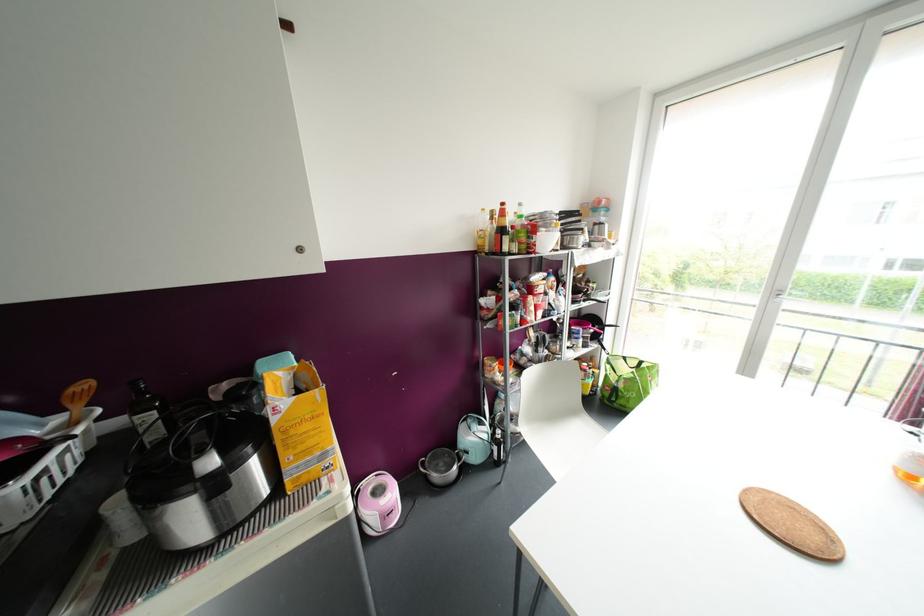
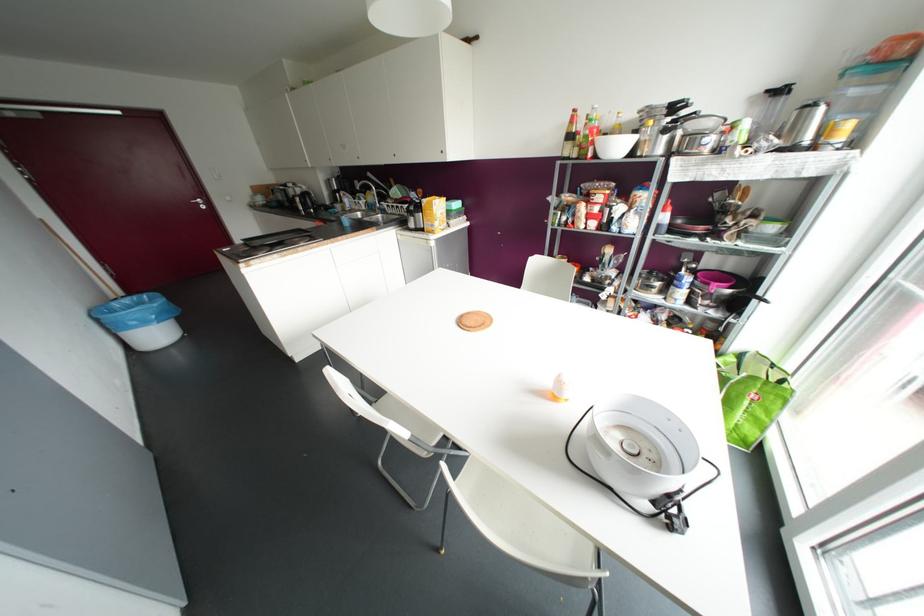
The point at (502, 204) is marked in the first image. Where is the corresponding point in the second image?

(574, 110)